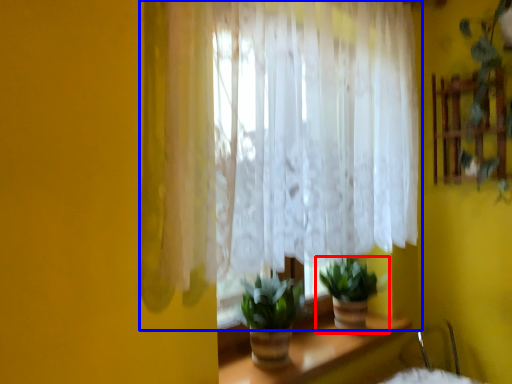
Question: Which of the following is the closest to the observer, houseplant (highlighted by a red box) or curtain (highlighted by a blue box)?

Choices:
 (A) houseplant
 (B) curtain

Answer: (B)